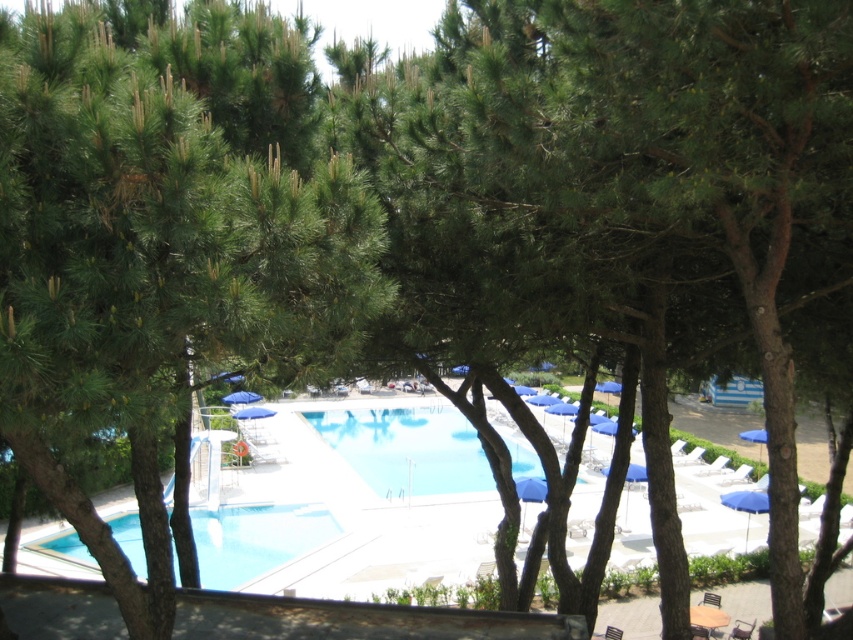
You are standing at the edge of the swimming pool and looking towards the lounge chairs. There are two points marked on the pool deck at coordinates point [341,420] and point [245,403]. Which point is closer to your current position?

Point [245,403] is closer to your current position because it is closer to the camera compared to point [341,420], which is further away.

You are planning to take a photo of the clear blue water at center and the blue fabric umbrella at center from the edge of the pool deck. Which object will appear larger in the photo?

The clear blue water at center appears larger in the photo because it is taller than the blue fabric umbrella at center.